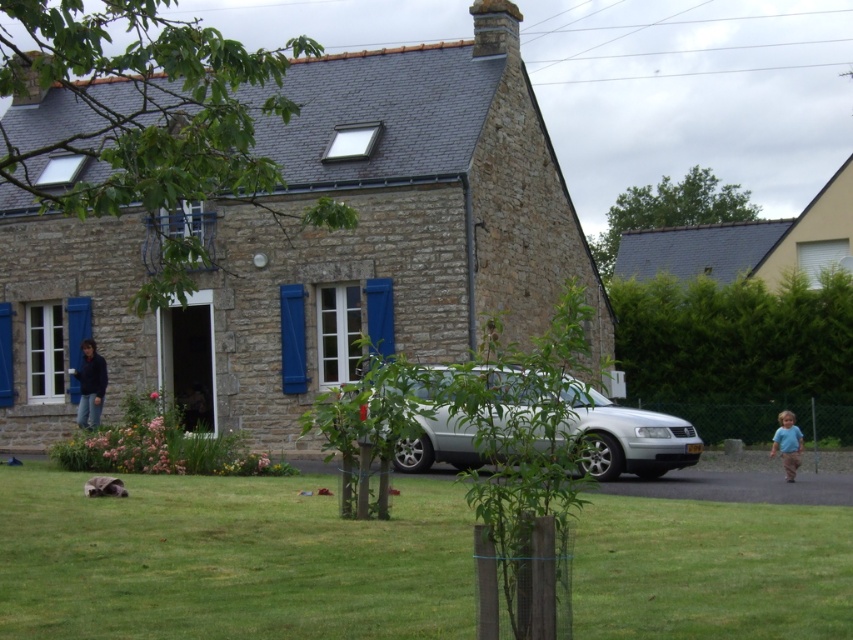
Question: From the image, what is the correct spatial relationship of satin silver car at center in relation to gray slate roof at upper right?

Choices:
 (A) below
 (B) above

Answer: (A)

Question: Can you confirm if satin silver car at center is positioned above gray slate roof at upper right?

Choices:
 (A) no
 (B) yes

Answer: (A)

Question: Which object is positioned farthest from the dark blue jeans at lower left?

Choices:
 (A) blue cotton shirt at lower right
 (B) gray slate roof at upper right
 (C) green grass at lower center

Answer: (B)

Question: Is gray slate roof at upper right smaller than dark blue jeans at lower left?

Choices:
 (A) no
 (B) yes

Answer: (A)

Question: Based on their relative distances, which object is nearer to the satin silver car at center?

Choices:
 (A) dark blue jeans at lower left
 (B) gray slate roof at upper right
 (C) blue cotton shirt at lower right

Answer: (C)

Question: Considering the real-world distances, which object is closest to the dark blue jeans at lower left?

Choices:
 (A) stone cottage at center
 (B) blue cotton shirt at lower right
 (C) satin silver car at center
 (D) green grass at lower center

Answer: (A)